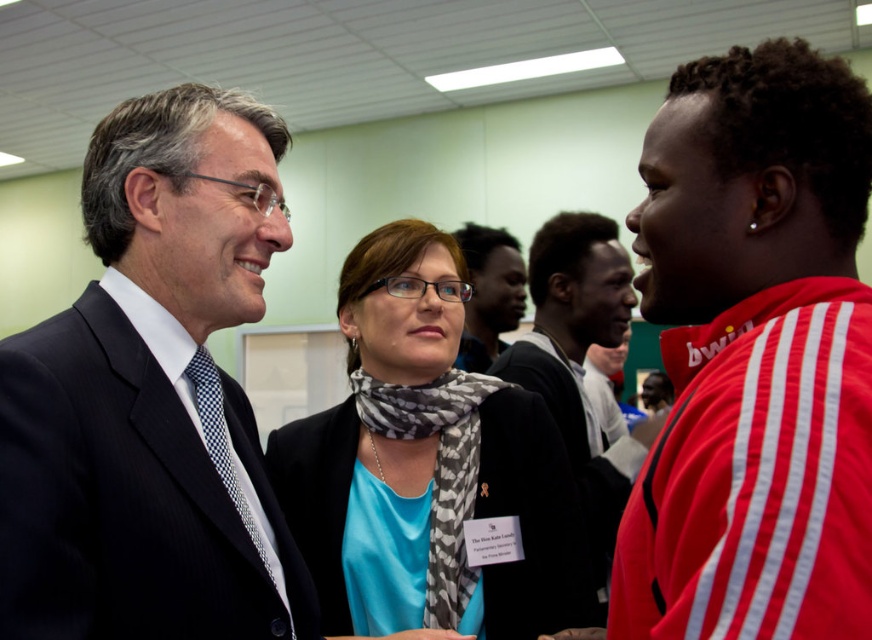
You are a photographer at a professional event. You need to take a closeup photo of the dark skin textured face at center and the matte black suit at center. Which object should you focus on first to ensure it appears sharp in the photo?

You should focus on the dark skin textured face at center first because it is closer to the viewer than the matte black suit at center, so focusing on it will ensure it is sharp while the background may blur slightly.

You are a photographer at a professional event. You need to adjust your camera to focus on two subjects in the scene, the dark blue suit at center and the dark skin textured face at center. Which subject should you focus on first if you want to prioritize the one that is taller?

The dark blue suit at center is taller than the dark skin textured face at center, so you should focus on the dark blue suit at center first.

Based on the scene description, where is the dark blue suit at center located in terms of its 2D coordinates?

The dark blue suit at center is located at the 2D coordinates point (148,397).